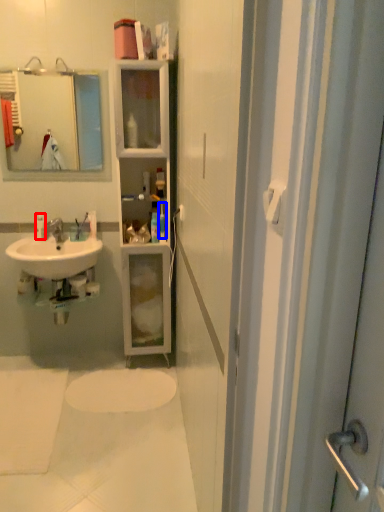
Question: Which object appears closest to the camera in this image, toiletry (highlighted by a red box) or toiletry (highlighted by a blue box)?

Choices:
 (A) toiletry
 (B) toiletry

Answer: (B)